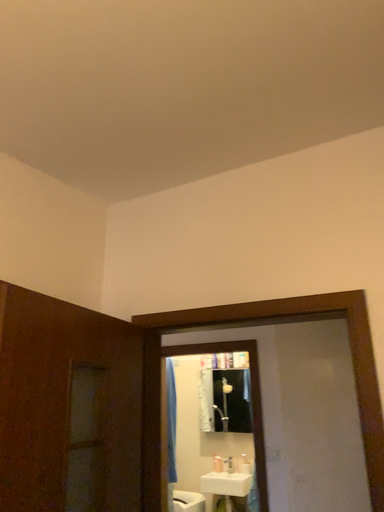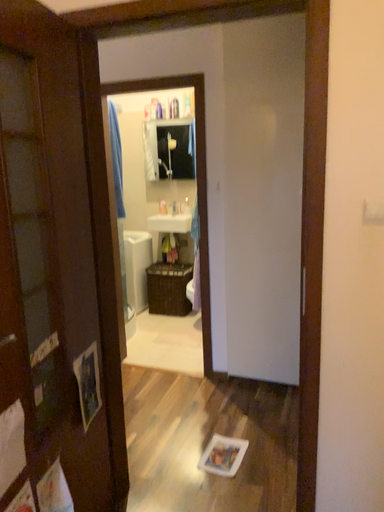
Question: Which way did the camera rotate in the video?

Choices:
 (A) rotated upward
 (B) rotated downward

Answer: (B)